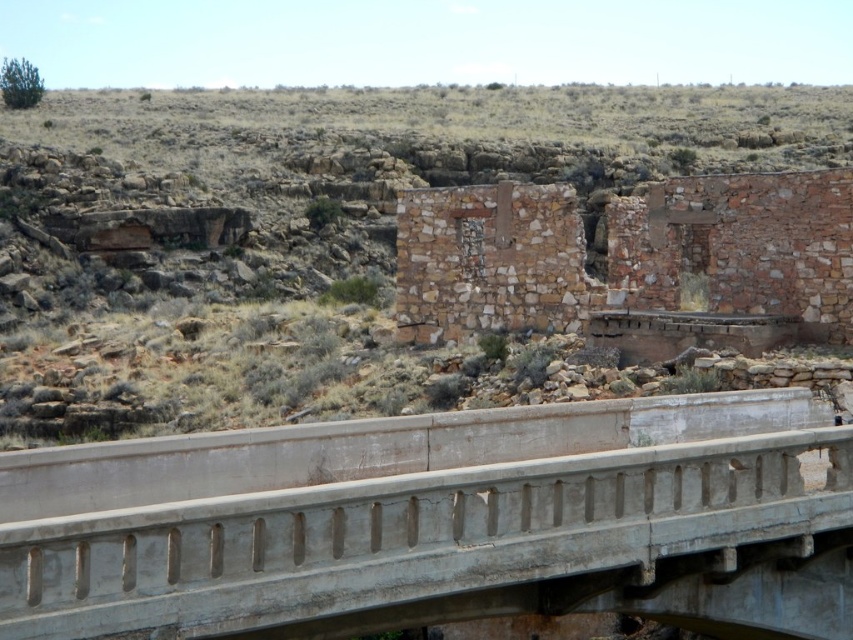
You are standing on the concrete bridge and want to reach a specific point in the scene. Which of the two points, point (583, 540) or point (585, 285), is closer to you?

Point (583, 540) is closer to the camera than point (585, 285), so it is the closer one.

You are a hiker carrying a large backpack and need to cross the concrete bridge at center. The bridge is over the brown stone ruins at center. Can you safely cross the bridge if your backpack is 1 meter wide?

The concrete bridge at center might be wider than brown stone ruins at center, so it is possible that the bridge can support a backpack of 1 meter width. However, since the exact width isn not specified, there is uncertainty in the answer.

You are standing at point [437,524] in the image. What object are you standing on?

You are standing on the concrete bridge at center.